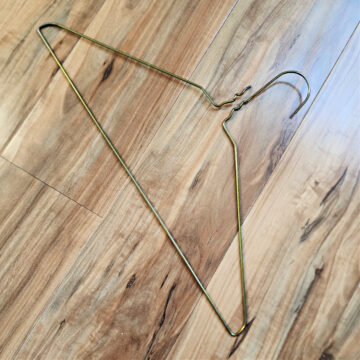
This screenshot has height=360, width=360. In order to click on front of hook on hanger in this screenshot , I will do `click(301, 104)`.